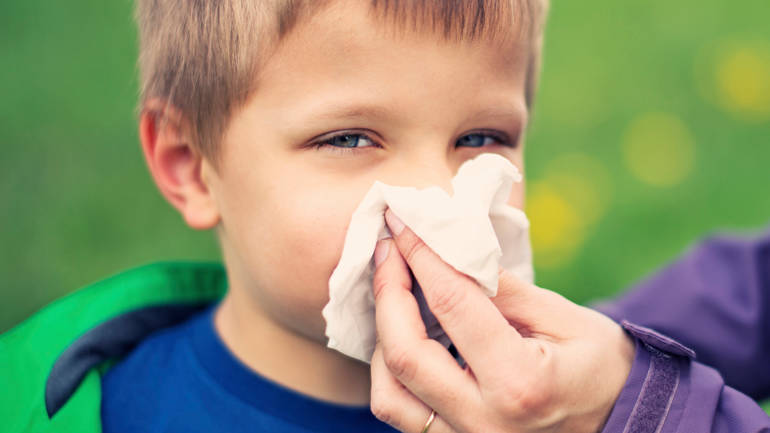
In order to click on tissue in this screenshot , I will do `click(471, 234)`.